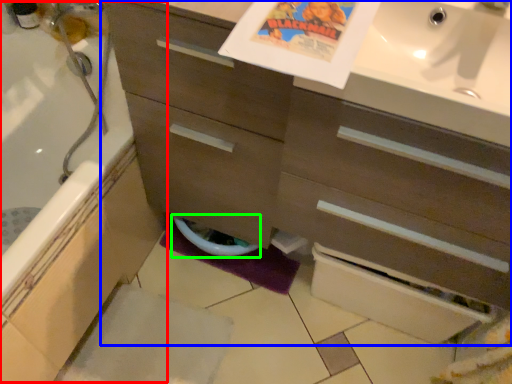
Question: Estimate the real-world distances between objects in this image. Which object is farther from bath (highlighted by a red box), bathroom cabinet (highlighted by a blue box) or toilet bowl (highlighted by a green box)?

Choices:
 (A) bathroom cabinet
 (B) toilet bowl

Answer: (A)